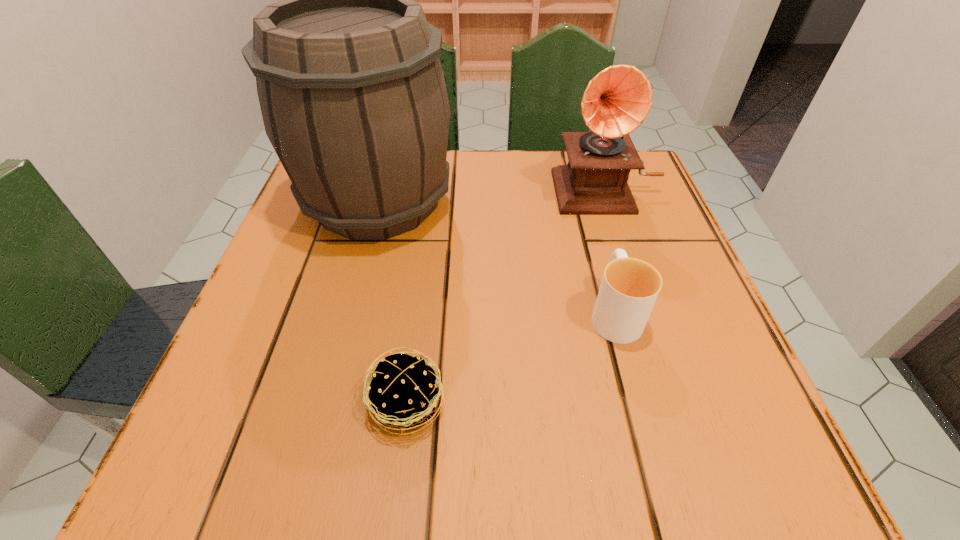
You are a GUI agent. You are given a task and a screenshot of the screen. Output one action in this format:
    pyautogui.click(x=<x>, y=<y>)
    Task: Click on the free spot at the far edge of the desktop
    Image resolution: width=960 pixels, height=540 pixels.
    Given the screenshot: What is the action you would take?
    pyautogui.click(x=525, y=176)

This screenshot has width=960, height=540. In order to click on free spot at the near edge of the desktop in this screenshot , I will do `click(533, 423)`.

Where is `free region at the left edge`? Image resolution: width=960 pixels, height=540 pixels. free region at the left edge is located at coordinates (338, 281).

The image size is (960, 540). In order to click on free space at the right edge in this screenshot , I will do `click(659, 238)`.

Locate an element on the screen. This screenshot has height=540, width=960. vacant space at the far right corner of the desktop is located at coordinates (637, 202).

Where is `vacant space at the near right corner of the desktop`? The height and width of the screenshot is (540, 960). vacant space at the near right corner of the desktop is located at coordinates (760, 457).

The width and height of the screenshot is (960, 540). Identify the location of free area in between the nearest object and the tallest object. [393, 303].

You are a GUI agent. You are given a task and a screenshot of the screen. Output one action in this format:
    pyautogui.click(x=<x>, y=<y>)
    Task: Click on the vacant space that's between the tallest object and the second shortest object
    The width and height of the screenshot is (960, 540).
    Given the screenshot: What is the action you would take?
    pyautogui.click(x=496, y=256)

Find the location of a particular element. vacant area that lies between the cup and the second tallest object is located at coordinates (610, 249).

Locate an element on the screen. vacant point located between the phonograph record and the tallest object is located at coordinates (492, 194).